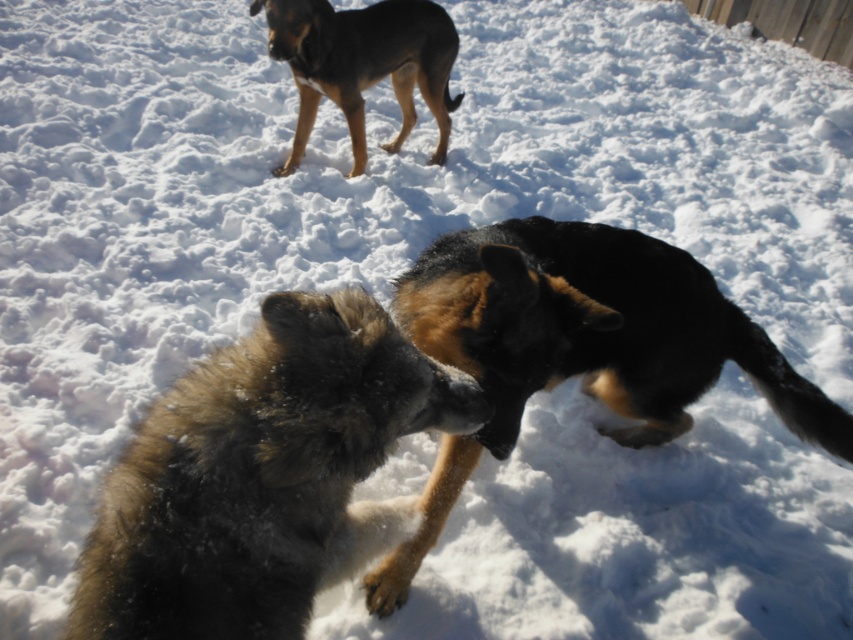
Is black fur dog at center to the left of brown fur dog at upper left from the viewer's perspective?

No, black fur dog at center is not to the left of brown fur dog at upper left.

Can you confirm if black fur dog at center is taller than brown fur dog at upper left?

Indeed, black fur dog at center has a greater height compared to brown fur dog at upper left.

Does point (425, 285) lie behind point (302, 100)?

No, (425, 285) is closer to viewer.

I want to click on black fur dog at center, so click(579, 348).

Is fuzzy fur dog at center closer to camera compared to black fur dog at center?

Yes, it is in front of black fur dog at center.

Consider the image. Does fuzzy fur dog at center have a greater width compared to black fur dog at center?

In fact, fuzzy fur dog at center might be narrower than black fur dog at center.

Is point (288, 611) positioned after point (409, 554)?

No, (288, 611) is closer to viewer.

At what (x,y) coordinates should I click in order to perform the action: click on fuzzy fur dog at center. Please return your answer as a coordinate pair (x, y). The height and width of the screenshot is (640, 853). Looking at the image, I should click on (262, 476).

Which is more to the left, fuzzy fur dog at center or brown fur dog at upper left?

From the viewer's perspective, brown fur dog at upper left appears more on the left side.

Based on the photo, is fuzzy fur dog at center in front of brown fur dog at upper left?

Yes, it is.

Describe the element at coordinates (262, 476) in the screenshot. I see `fuzzy fur dog at center` at that location.

The image size is (853, 640). I want to click on fuzzy fur dog at center, so click(262, 476).